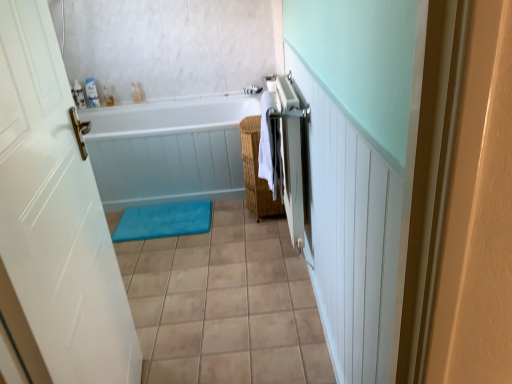
This screenshot has width=512, height=384. What do you see at coordinates (289, 152) in the screenshot? I see `silver metallic towel rack at right` at bounding box center [289, 152].

At what (x,y) coordinates should I click in order to perform the action: click on beige ceramic tile at center. Please return your answer as a coordinate pair (x, y). Looking at the image, I should click on (225, 304).

What is the approximate height of white glossy door at left?

white glossy door at left is 1.32 meters in height.

The height and width of the screenshot is (384, 512). Describe the element at coordinates (108, 96) in the screenshot. I see `clear plastic bottle at upper left` at that location.

Where is `woven brown basket at center-right`? This screenshot has height=384, width=512. woven brown basket at center-right is located at coordinates (256, 173).

Between white glossy bathtub at center and white woven beach towel at center, which one has larger width?

white glossy bathtub at center.

Is point (191, 120) behind point (270, 189)?

Yes, it is.

In terms of size, does white glossy bathtub at center appear bigger or smaller than white woven beach towel at center?

Clearly, white glossy bathtub at center is larger in size than white woven beach towel at center.

Measure the distance from white glossy bathtub at center to white woven beach towel at center.

white glossy bathtub at center is 29.11 inches from white woven beach towel at center.

What's the angular difference between woven brown basket at center-right and beige ceramic tile at center's facing directions?

90 degrees.

Is woven brown basket at center-right far away from beige ceramic tile at center?

No, woven brown basket at center-right is not far from beige ceramic tile at center.

Is woven brown basket at center-right at the right side of beige ceramic tile at center?

Correct, you'll find woven brown basket at center-right to the right of beige ceramic tile at center.

From the image's perspective, between woven brown basket at center-right and beige ceramic tile at center, who is located below?

beige ceramic tile at center is shown below in the image.

Is white glossy door at left oriented towards beige ceramic tile at center?

No, white glossy door at left is not oriented towards beige ceramic tile at center.

Considering the positions of objects white glossy door at left and beige ceramic tile at center in the image provided, who is more to the left, white glossy door at left or beige ceramic tile at center?

white glossy door at left.

Which of these two, white glossy door at left or beige ceramic tile at center, stands shorter?

With less height is beige ceramic tile at center.

This screenshot has height=384, width=512. Identify the location of door to the left of beige ceramic tile at center. (54, 221).

Considering the positions of points (274, 106) and (198, 227), is point (274, 106) farther from camera compared to point (198, 227)?

That is False.

Does white woven beach towel at center contain blue soft bath mat at center?

No.

Would you say white woven beach towel at center is a long distance from blue soft bath mat at center?

No, white woven beach towel at center is in close proximity to blue soft bath mat at center.

From the image's perspective, which one is positioned lower, white woven beach towel at center or blue soft bath mat at center?

blue soft bath mat at center.

Considering the sizes of objects white glossy bathtub at center and beige ceramic tile at center in the image provided, who is taller, white glossy bathtub at center or beige ceramic tile at center?

white glossy bathtub at center is taller.

Looking at this image, is white glossy bathtub at center with beige ceramic tile at center?

No.

In the image, is white glossy bathtub at center on the left side or the right side of beige ceramic tile at center?

Based on their positions, white glossy bathtub at center is located to the left of beige ceramic tile at center.

Between white glossy bathtub at center and silver metallic towel rack at right, which one has less height?

With less height is white glossy bathtub at center.

Looking at the image, does white glossy bathtub at center seem bigger or smaller compared to silver metallic towel rack at right?

white glossy bathtub at center is bigger than silver metallic towel rack at right.

From the image's perspective, is white glossy bathtub at center located above silver metallic towel rack at right?

Correct, white glossy bathtub at center appears higher than silver metallic towel rack at right in the image.

In terms of width, does white glossy bathtub at center look wider or thinner when compared to silver metallic towel rack at right?

In the image, white glossy bathtub at center appears to be wider than silver metallic towel rack at right.

Which object is wider, white woven beach towel at center or clear plastic bottle at upper left?

white woven beach towel at center is wider.

Based on the photo, from a real-world perspective, which object stands above the other?

In real-world perspective, white woven beach towel at center is above.

Is white woven beach towel at center spatially inside clear plastic bottle at upper left, or outside of it?

white woven beach towel at center cannot be found inside clear plastic bottle at upper left.

From the image's perspective, is white woven beach towel at center on top of clear plastic bottle at upper left?

Incorrect, from the image's perspective, white woven beach towel at center is lower than clear plastic bottle at upper left.

This screenshot has width=512, height=384. I want to click on bathtub located above the white woven beach towel at center (from the image's perspective), so click(168, 149).

Where is `basket above the beige ceramic tile at center (from a real-world perspective)`? basket above the beige ceramic tile at center (from a real-world perspective) is located at coordinates (256, 173).

Estimate the real-world distances between objects in this image. Which object is closer to white glossy bathtub at center, beige ceramic tile at center or silver metallic towel rack at right?

The object closer to white glossy bathtub at center is beige ceramic tile at center.

Looking at the image, which one is located further to white glossy bathtub at center, beige ceramic tile at center or white glossy door at left?

white glossy door at left.

When comparing their distances from blue soft bath mat at center, does white glossy bathtub at center or silver metallic towel rack at right seem closer?

Based on the image, white glossy bathtub at center appears to be nearer to blue soft bath mat at center.

Based on their spatial positions, is white glossy door at left or beige ceramic tile at center closer to clear plastic bottle at upper left?

beige ceramic tile at center is closer to clear plastic bottle at upper left.

Considering their positions, is beige ceramic tile at center positioned further to blue soft bath mat at center than clear plastic bottle at upper left?

Based on the image, clear plastic bottle at upper left appears to be further to blue soft bath mat at center.

When comparing their distances from clear plastic bottle at upper left, does white glossy bathtub at center or white glossy door at left seem closer?

Based on the image, white glossy bathtub at center appears to be nearer to clear plastic bottle at upper left.

Estimate the real-world distances between objects in this image. Which object is closer to woven brown basket at center-right, white glossy door at left or blue soft bath mat at center?

Among the two, blue soft bath mat at center is located nearer to woven brown basket at center-right.

Looking at this image, based on their spatial positions, is white glossy door at left or white glossy bathtub at center closer to beige ceramic tile at center?

white glossy door at left lies closer to beige ceramic tile at center than the other object.

Where is `beach towel located between silver metallic towel rack at right and clear plastic bottle at upper left in the depth direction`? This screenshot has height=384, width=512. beach towel located between silver metallic towel rack at right and clear plastic bottle at upper left in the depth direction is located at coordinates (266, 142).

I want to click on beach towel positioned between silver metallic towel rack at right and white glossy bathtub at center from near to far, so click(x=266, y=142).

Identify the location of shower door between white glossy door at left and white woven beach towel at center in the front-back direction. Image resolution: width=512 pixels, height=384 pixels. (289, 152).

What are the coordinates of `shower door located between white glossy door at left and woven brown basket at center-right in the depth direction` in the screenshot? It's located at (289, 152).